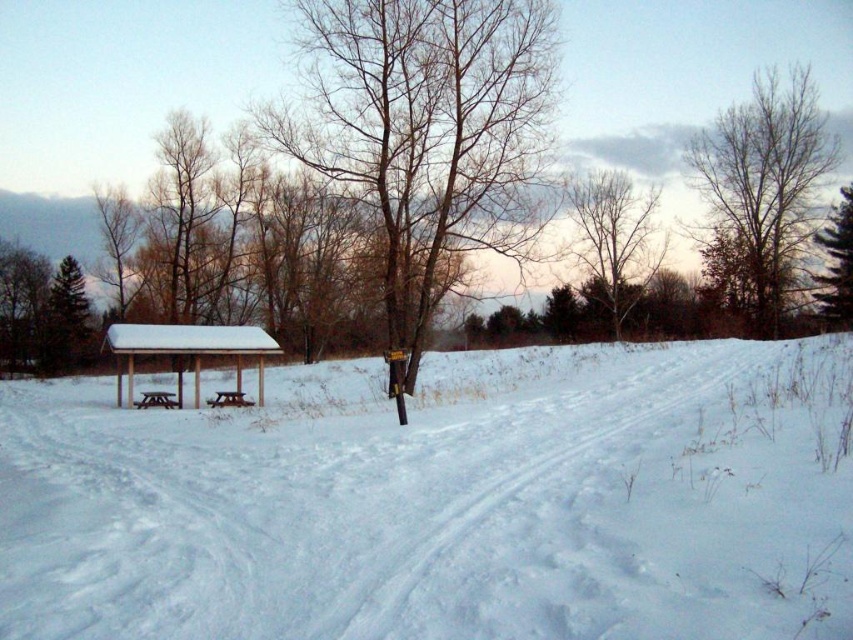
Question: Is white powdery snow at center closer to the viewer compared to bare wood tree at upper right?

Choices:
 (A) yes
 (B) no

Answer: (A)

Question: Which of these objects is positioned farthest from the white wooden shelter at center?

Choices:
 (A) green matte tree at left
 (B) bare branches at center
 (C) wooden picnic table at center-left

Answer: (A)

Question: Can you confirm if bare branches at upper center is smaller than white wooden shelter at center?

Choices:
 (A) yes
 (B) no

Answer: (B)

Question: Observing the image, what is the correct spatial positioning of bare branches at upper center in reference to white wooden shelter at center?

Choices:
 (A) below
 (B) above

Answer: (B)

Question: Which object is farther from the camera taking this photo?

Choices:
 (A) wooden picnic table at center-left
 (B) green evergreen tree at right
 (C) white wooden shelter at center
 (D) bare branches at center

Answer: (B)

Question: Among these objects, which one is farthest from the camera?

Choices:
 (A) wooden picnic table at center-left
 (B) wooden picnic table at center
 (C) green matte tree at left
 (D) bare branches at upper center

Answer: (C)